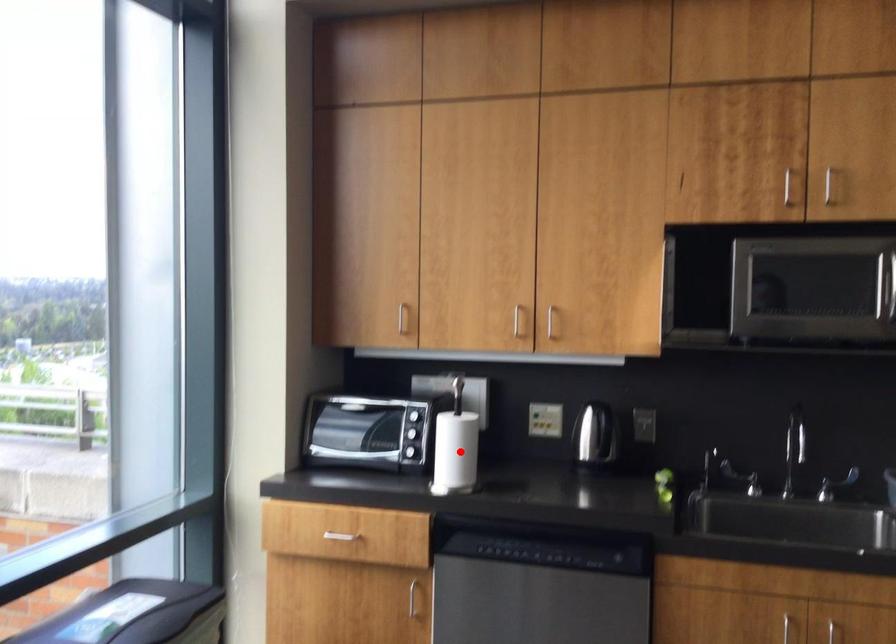
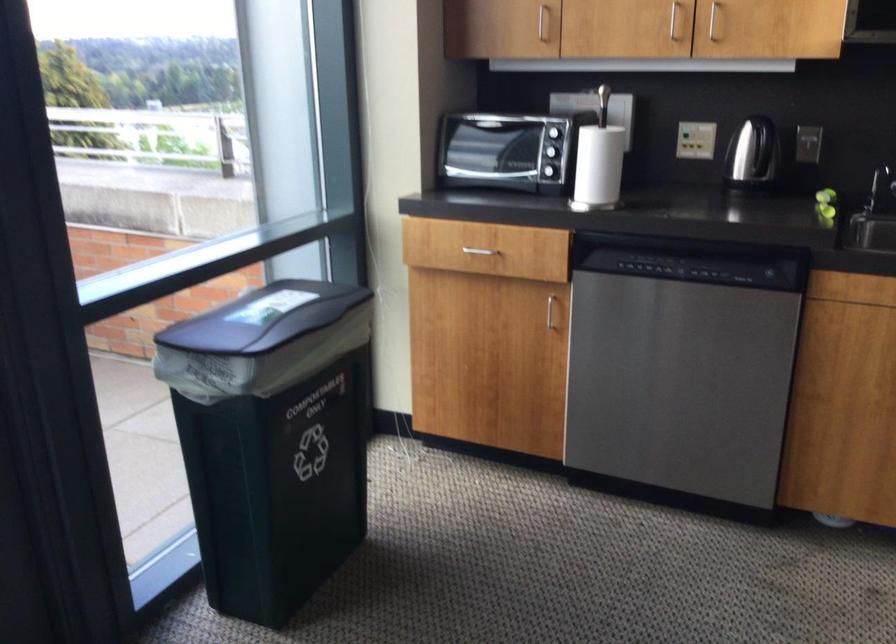
Find the pixel in the second image that matches the highlighted location in the first image.

(599, 165)